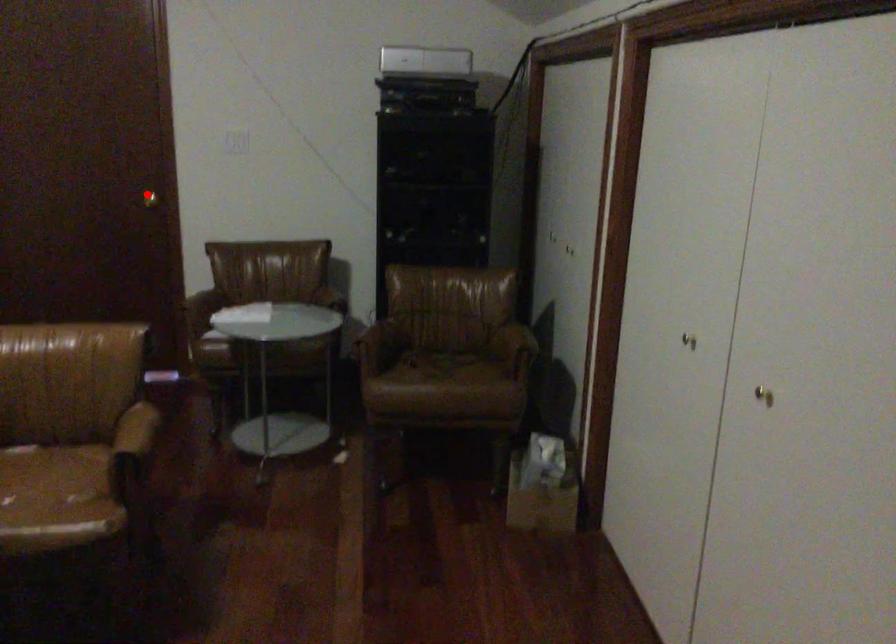
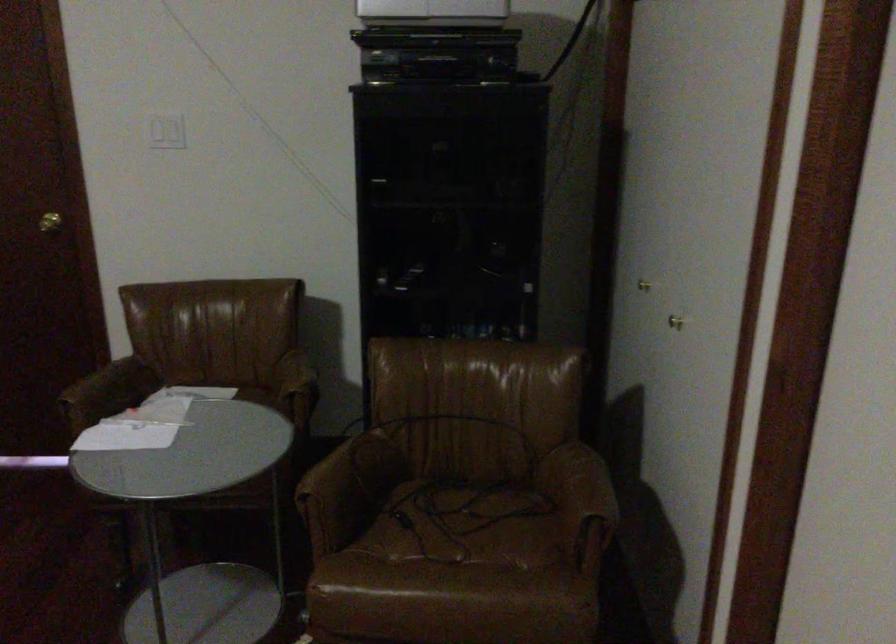
Question: A red point is marked in image1. In image2, is the corresponding 3D point closer to the camera or farther? Reply with the corresponding letter.

Choices:
 (A) The corresponding 3D point is closer.
 (B) The corresponding 3D point is farther.

Answer: (A)